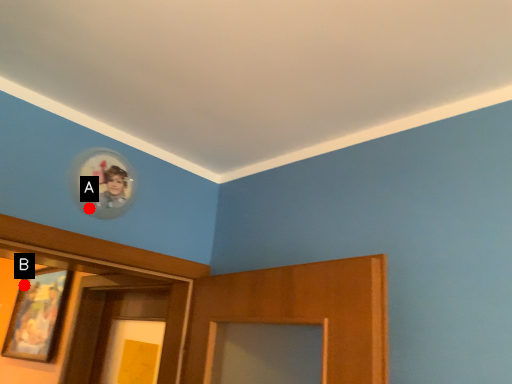
Question: Two points are circled on the image, labeled by A and B beside each circle. Which of the following is the farthest from the observer?

Choices:
 (A) A is further
 (B) B is further

Answer: (B)